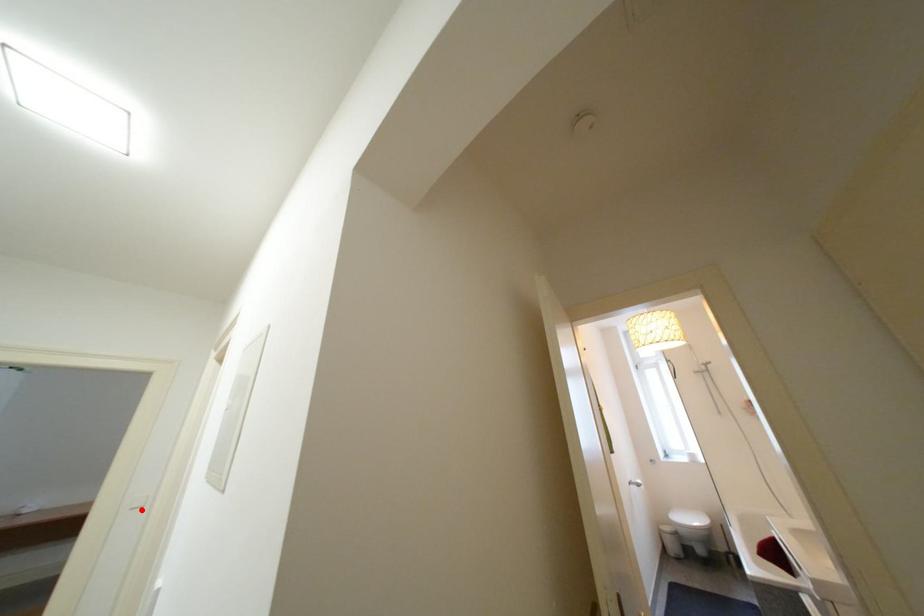
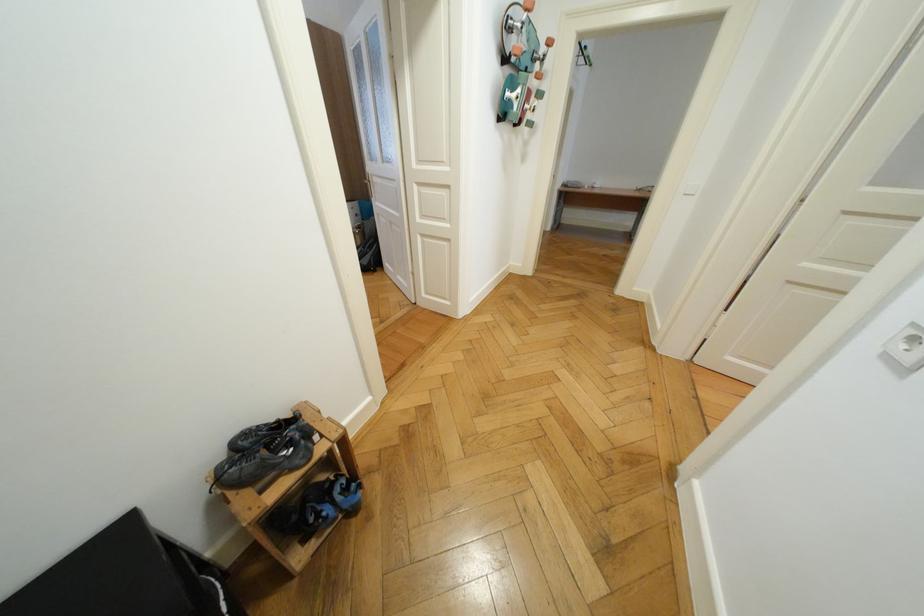
Question: A red point is marked in image1. In image2, is the corresponding 3D point closer to the camera or farther? Reply with the corresponding letter.

Choices:
 (A) The corresponding 3D point is closer.
 (B) The corresponding 3D point is farther.

Answer: (B)